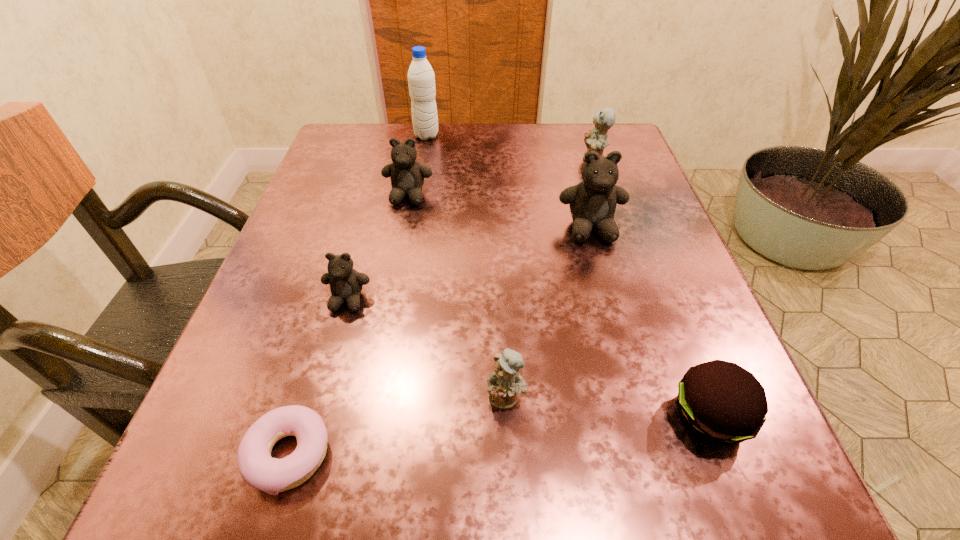
This screenshot has width=960, height=540. Identify the location of vacant region located 0.350m on the face of the third farthest object. (377, 361).

At what (x,y) coordinates should I click in order to perform the action: click on free space located 0.280m on the face of the fifth farthest object. Please return your answer as a coordinate pair (x, y). The width and height of the screenshot is (960, 540). Looking at the image, I should click on (289, 514).

The height and width of the screenshot is (540, 960). Find the location of `free region located 0.060m on the front-facing side of the nearest teddy bear`. free region located 0.060m on the front-facing side of the nearest teddy bear is located at coordinates (509, 458).

Locate an element on the screen. vacant space situated on the back of the patty is located at coordinates (667, 308).

Where is `vacant space situated on the back of the shortest object`? This screenshot has width=960, height=540. vacant space situated on the back of the shortest object is located at coordinates (360, 218).

Identify the location of water bottle that is at the far edge. This screenshot has width=960, height=540. (421, 79).

Locate an element on the screen. teddy bear that is positioned at the far edge is located at coordinates (596, 140).

At what (x,y) coordinates should I click in order to perform the action: click on patty located at the near edge. Please return your answer as a coordinate pair (x, y). Looking at the image, I should click on (720, 402).

You are a GUI agent. You are given a task and a screenshot of the screen. Output one action in this format:
    pyautogui.click(x=<x>, y=<y>)
    Task: Click on the doughnut at the near edge
    
    Given the screenshot: What is the action you would take?
    [x=258, y=469]

Where is `doughnut at the left edge`? The image size is (960, 540). doughnut at the left edge is located at coordinates (258, 469).